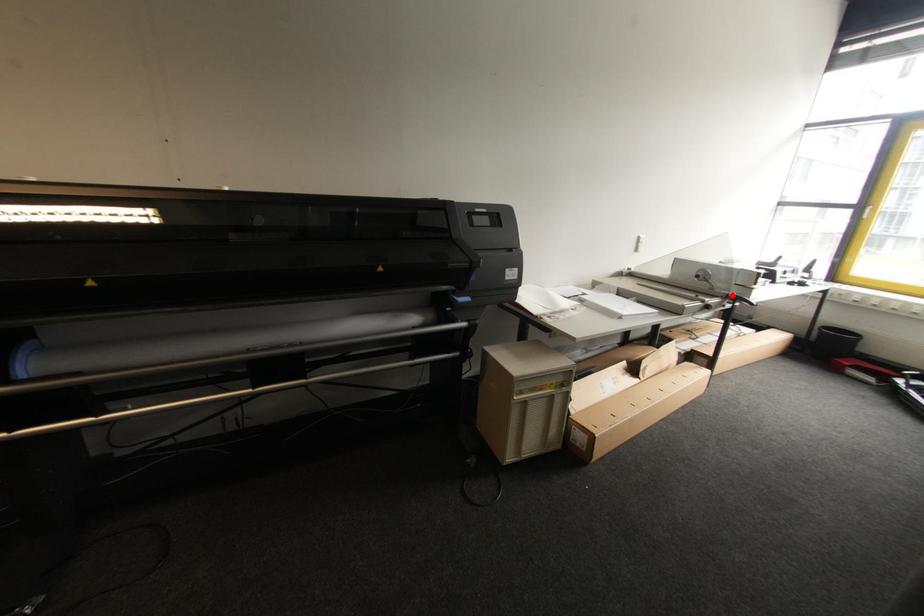
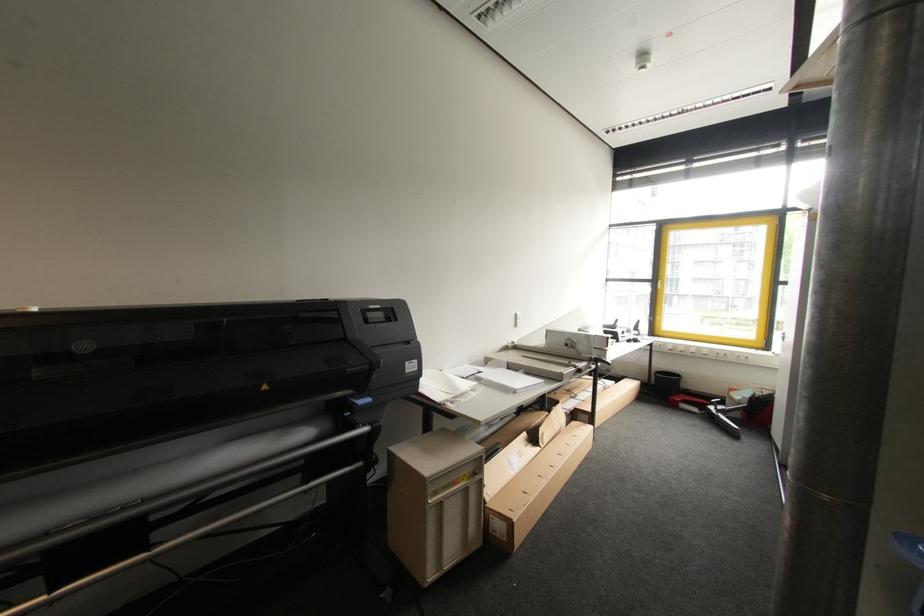
Locate, in the second image, the point that corresponds to the highlighted location in the first image.

(594, 359)